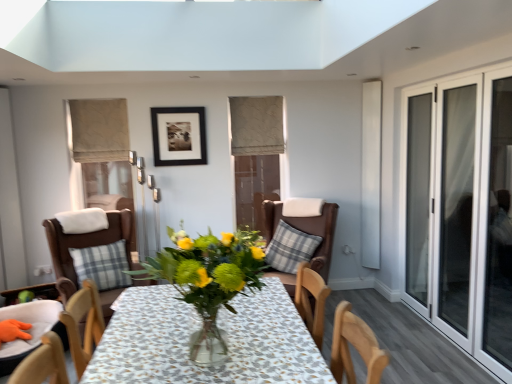
Question: Does black matte picture frame at upper center turn towards transparent glass door at right?

Choices:
 (A) no
 (B) yes

Answer: (A)

Question: Is transparent glass door at right a part of black matte picture frame at upper center?

Choices:
 (A) yes
 (B) no

Answer: (B)

Question: Does black matte picture frame at upper center have a lesser height compared to transparent glass door at right?

Choices:
 (A) yes
 (B) no

Answer: (A)

Question: Are black matte picture frame at upper center and transparent glass door at right far apart?

Choices:
 (A) yes
 (B) no

Answer: (A)

Question: Does black matte picture frame at upper center have a greater width compared to transparent glass door at right?

Choices:
 (A) yes
 (B) no

Answer: (A)

Question: Considering the relative sizes of black matte picture frame at upper center and transparent glass door at right in the image provided, is black matte picture frame at upper center thinner than transparent glass door at right?

Choices:
 (A) no
 (B) yes

Answer: (A)

Question: Does brown leather chair at center, which is counted as the third chair, starting from the left, have a larger size compared to beige fabric curtain at upper left, which ranks as the 1th curtain in front-to-back order?

Choices:
 (A) no
 (B) yes

Answer: (B)

Question: Is brown leather chair at center, which is counted as the third chair, starting from the left, to the right of beige fabric curtain at upper left, the second curtain positioned from the right, from the viewer's perspective?

Choices:
 (A) yes
 (B) no

Answer: (A)

Question: From the image's perspective, would you say brown leather chair at center, which is the 1th chair from right to left, is positioned over beige fabric curtain at upper left, which ranks as the 1th curtain in front-to-back order?

Choices:
 (A) yes
 (B) no

Answer: (B)

Question: Is the depth of brown leather chair at center, which is counted as the third chair, starting from the left, greater than that of beige fabric curtain at upper left, positioned as the 2th curtain in back-to-front order?

Choices:
 (A) no
 (B) yes

Answer: (A)

Question: Is brown leather chair at center, which is counted as the third chair, starting from the left, smaller than beige fabric curtain at upper left, positioned as the 2th curtain in back-to-front order?

Choices:
 (A) yes
 (B) no

Answer: (B)

Question: From a real-world perspective, is brown leather chair at center, which is the 1th chair from right to left, positioned over beige fabric curtain at upper left, which ranks as the 1th curtain in front-to-back order, based on gravity?

Choices:
 (A) yes
 (B) no

Answer: (B)

Question: Is black matte picture frame at upper center next to beige fabric curtain at upper center, which is the first curtain from back to front, and touching it?

Choices:
 (A) no
 (B) yes

Answer: (A)